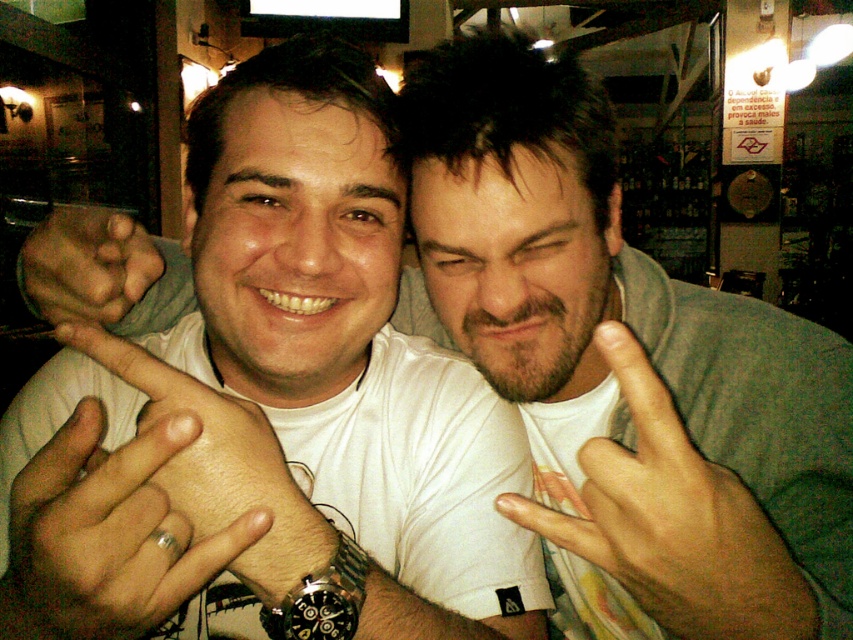
Question: Is beige fabric hand at center to the left of silver metallic ring at lower left from the viewer's perspective?

Choices:
 (A) yes
 (B) no

Answer: (B)

Question: Among these points, which one is nearest to the camera?

Choices:
 (A) (310, 620)
 (B) (143, 481)
 (C) (107, 259)
 (D) (647, 445)

Answer: (D)

Question: Estimate the real-world distances between objects in this image. Which object is farther from the matte skin hand at center?

Choices:
 (A) silver metallic ring at lower left
 (B) beige fabric hand at center

Answer: (B)

Question: Which of the following is the farthest from the observer?

Choices:
 (A) (53, 221)
 (B) (309, 596)

Answer: (A)

Question: Is beige fabric hand at center bigger than black metallic watch at center?

Choices:
 (A) no
 (B) yes

Answer: (B)

Question: Can you confirm if beige fabric hand at center is positioned to the left of silver metallic ring at lower left?

Choices:
 (A) yes
 (B) no

Answer: (B)